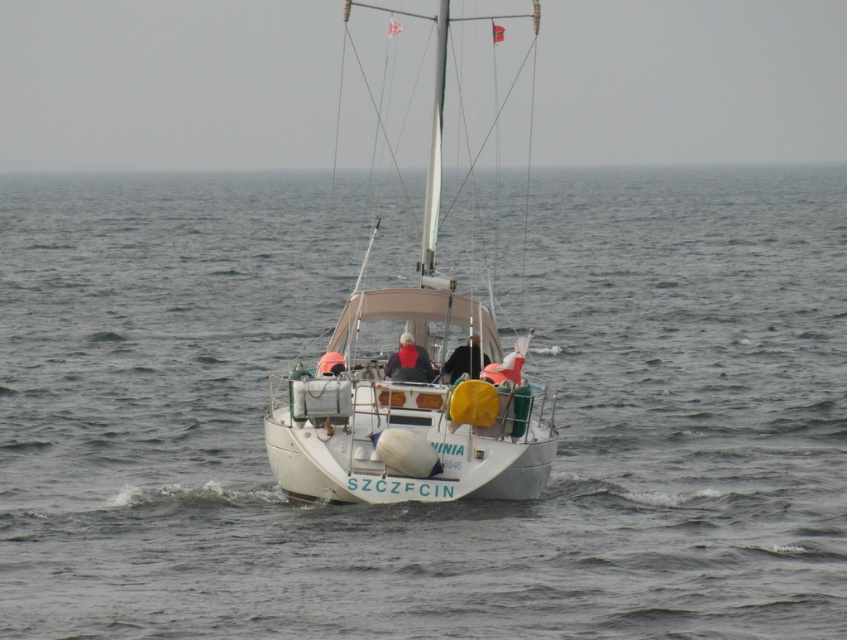
In the scene shown: You are a passenger on the white matte sailboat at center and want to move towards the black fabric jacket at center. Which direction should you go?

The white matte sailboat at center is to the left of the black fabric jacket at center, so you should move to your right to reach the black fabric jacket at center.

Based on the photo, you are a photographer trying to capture the white matte sailboat at center and the black fabric jacket at center in the same frame. Given that the sailboat is larger, which object should you focus on first to ensure both are in focus?

Since the white matte sailboat at center is larger than the black fabric jacket at center, you should focus on the white matte sailboat at center first to ensure both are in focus.